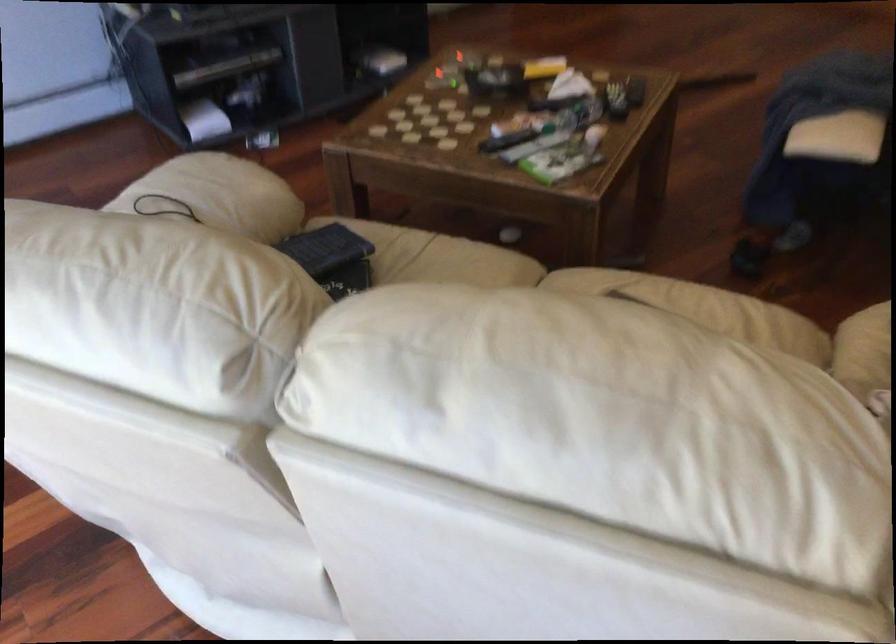
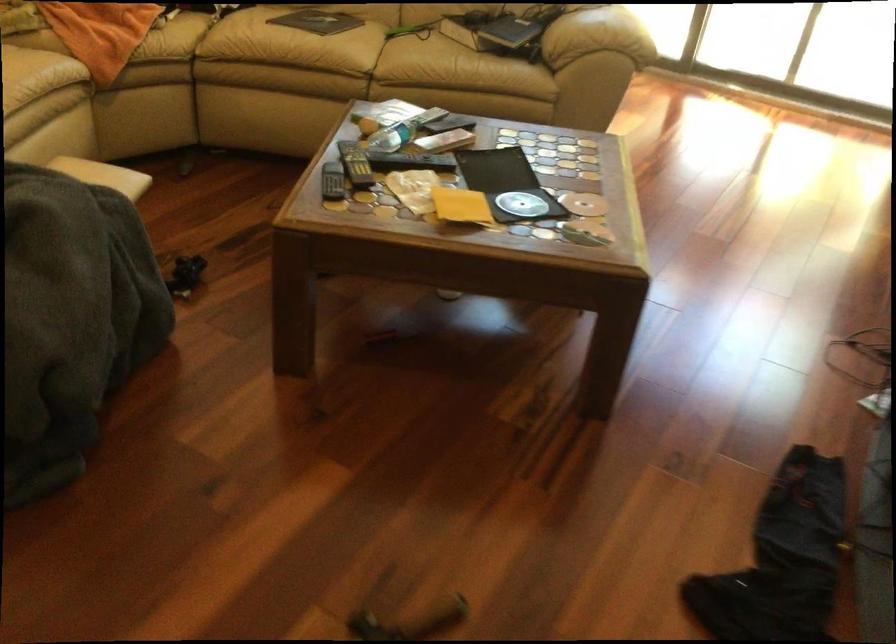
Find the pixel in the second image that matches the point at 494,84 in the first image.

(506, 184)